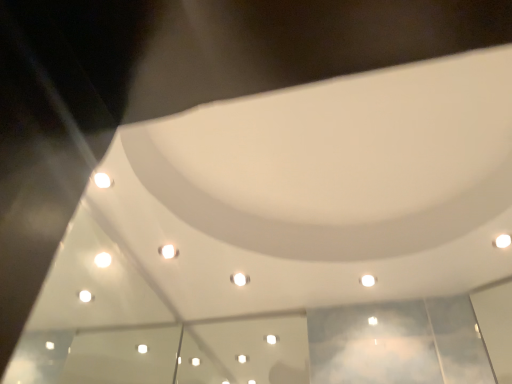
Question: Should I look upward or downward to see white glossy light at upper right, the 1th light positioned from the top?

Choices:
 (A) up
 (B) down

Answer: (B)

Question: Considering the relative sizes of white glossy light at upper right, the third light positioned from the bottom, and white glossy light at center, the third light when ordered from front to back, in the image provided, is white glossy light at upper right, the third light positioned from the bottom, smaller than white glossy light at center, the third light when ordered from front to back,?

Choices:
 (A) no
 (B) yes

Answer: (B)

Question: Is white glossy light at upper right, the third light positioned from the bottom, shorter than white glossy light at center, the third light when ordered from front to back?

Choices:
 (A) yes
 (B) no

Answer: (B)

Question: From a real-world perspective, is white glossy light at upper right, the third light positioned from the bottom, beneath white glossy light at center, marked as the 3th light in a right-to-left arrangement?

Choices:
 (A) yes
 (B) no

Answer: (B)

Question: Is white glossy light at upper right, the 1th light when ordered from right to left, closer to camera compared to white glossy light at center, the third light when ordered from front to back?

Choices:
 (A) no
 (B) yes

Answer: (B)

Question: Is white glossy light at upper right, the 1th light when ordered from right to left, bigger than white glossy light at center, marked as the 3th light in a right-to-left arrangement?

Choices:
 (A) yes
 (B) no

Answer: (B)

Question: Can you confirm if white glossy light at upper right, the 1th light when ordered from right to left, is wider than white glossy light at center, marked as the 3th light in a right-to-left arrangement?

Choices:
 (A) no
 (B) yes

Answer: (A)

Question: Is white glossy light at upper center, which is the 2th light from back to front, oriented towards white glossy light at upper right, the 1th light positioned from the top?

Choices:
 (A) yes
 (B) no

Answer: (B)

Question: From a real-world perspective, is white glossy light at upper center, placed as the 2th light when sorted from front to back, located higher than white glossy light at upper right, the third light positioned from the bottom?

Choices:
 (A) no
 (B) yes

Answer: (A)

Question: Can you confirm if white glossy light at upper center, placed as the second light when sorted from bottom to top, is wider than white glossy light at upper right, the 1th light when ordered from right to left?

Choices:
 (A) no
 (B) yes

Answer: (B)

Question: Considering the relative sizes of white glossy light at upper center, which is the 2th light from back to front, and white glossy light at upper right, which appears as the 1th light when viewed from the front, in the image provided, is white glossy light at upper center, which is the 2th light from back to front, bigger than white glossy light at upper right, which appears as the 1th light when viewed from the front,?

Choices:
 (A) yes
 (B) no

Answer: (B)

Question: Is white glossy light at upper center, placed as the 2th light when sorted from front to back, looking in the opposite direction of white glossy light at upper right, the 3th light viewed from the left?

Choices:
 (A) no
 (B) yes

Answer: (A)

Question: Is white glossy light at center, which ranks as the first light in back-to-front order, looking in the opposite direction of white glossy light at upper right, the 1th light positioned from the top?

Choices:
 (A) no
 (B) yes

Answer: (A)